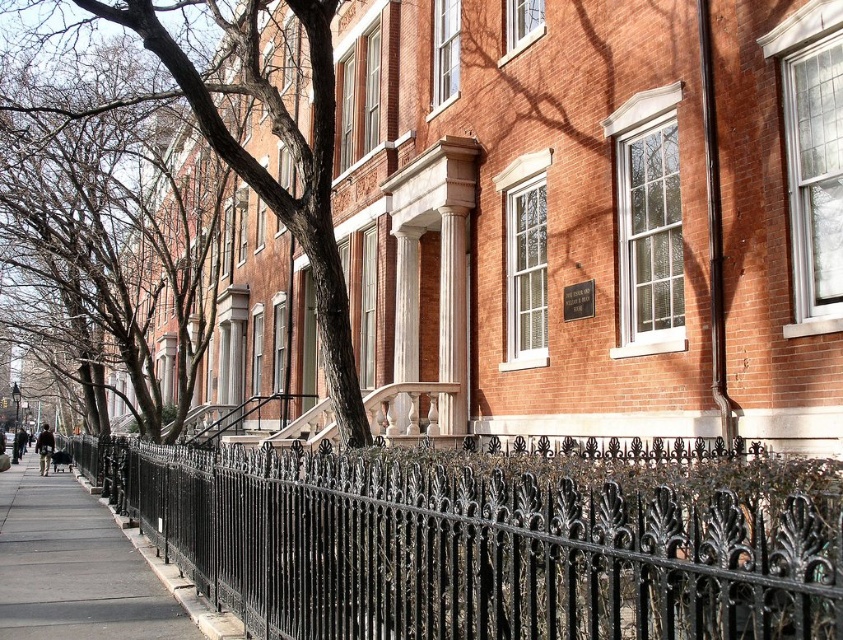
You are a delivery person with a cart that is 10 feet wide. You need to navigate through the space between the brown bark tree at center and the gray concrete sidewalk at lower left to reach the front door of the townhouse. Can your cart fit through this space?

The brown bark tree at center and gray concrete sidewalk at lower left are 19.05 feet apart from each other. Since your cart is 10 feet wide, there is enough space for it to pass through comfortably.

You are a delivery person approaching the row of brick townhouses. You need to reach the front door of the first house on the left. The gray concrete sidewalk at lower left is where you are currently standing. Which direction should you turn to walk towards the black wrought iron fence at lower center?

Since the black wrought iron fence at lower center is to the right of the gray concrete sidewalk at lower left, you should turn right to walk towards it.